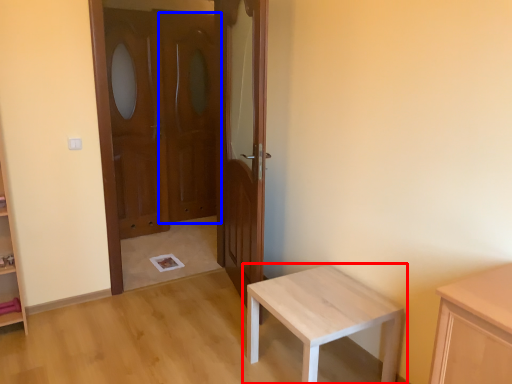
Question: Which of the following is the farthest to the observer, table (highlighted by a red box) or screen door (highlighted by a blue box)?

Choices:
 (A) table
 (B) screen door

Answer: (B)